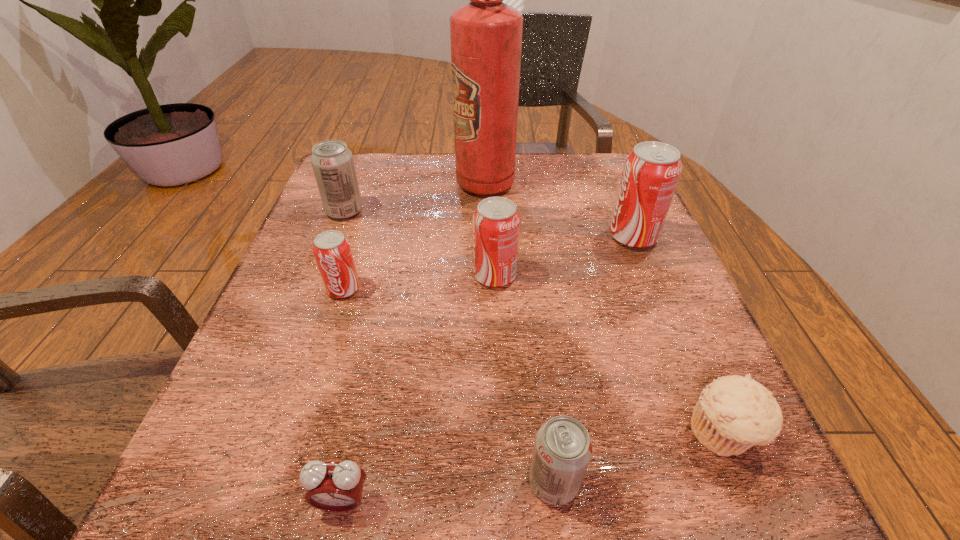
Where is `muffin that is at the near edge`? The height and width of the screenshot is (540, 960). muffin that is at the near edge is located at coordinates (734, 413).

The width and height of the screenshot is (960, 540). I want to click on soda can that is positioned at the right edge, so click(651, 172).

You are a GUI agent. You are given a task and a screenshot of the screen. Output one action in this format:
    pyautogui.click(x=<x>, y=<y>)
    Task: Click on the muffin that is at the right edge
    The width and height of the screenshot is (960, 540).
    Given the screenshot: What is the action you would take?
    pyautogui.click(x=734, y=413)

This screenshot has width=960, height=540. Find the location of `object situated at the far left corner`. object situated at the far left corner is located at coordinates (332, 162).

At what (x,y) coordinates should I click in order to perform the action: click on object that is positioned at the near right corner. Please return your answer as a coordinate pair (x, y). Looking at the image, I should click on (734, 413).

Locate an element on the screen. vacant area at the far edge is located at coordinates (540, 157).

The width and height of the screenshot is (960, 540). I want to click on free location at the left edge of the desktop, so [x=315, y=271].

Where is `free point at the right edge`? The image size is (960, 540). free point at the right edge is located at coordinates (624, 269).

This screenshot has height=540, width=960. Identify the location of blank space at the far right corner. (579, 154).

In the image, there is a desktop. Where is `vacant space at the near right corner`? This screenshot has width=960, height=540. vacant space at the near right corner is located at coordinates (756, 516).